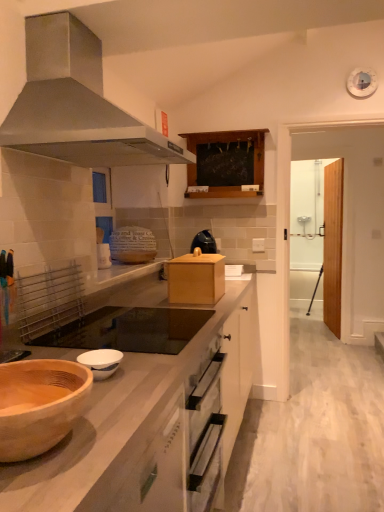
At what (x,y) coordinates should I click in order to perform the action: click on blank space situated above wooden cabinet at upper center (from a real-world perspective). Please return your answer as a coordinate pair (x, y). The height and width of the screenshot is (512, 384). Looking at the image, I should click on (232, 127).